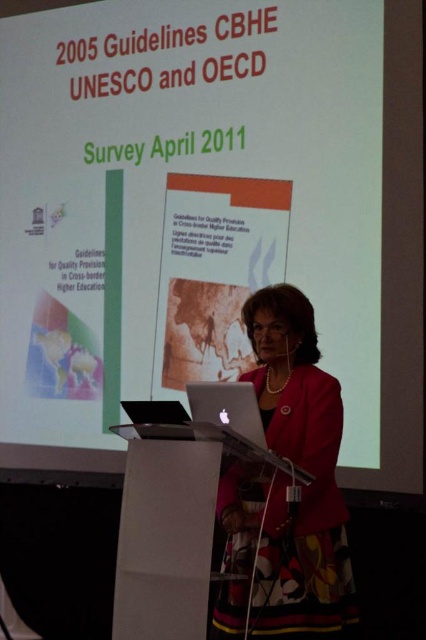
Question: Is matte black blazer at center bigger than silver metallic laptop at center?

Choices:
 (A) yes
 (B) no

Answer: (A)

Question: Among these objects, which one is farthest from the camera?

Choices:
 (A) matte black blazer at center
 (B) silver metallic laptop at center

Answer: (A)

Question: Which point is closer to the camera?

Choices:
 (A) silver metallic laptop at center
 (B) matte black blazer at center

Answer: (A)

Question: Considering the relative positions of matte black blazer at center and silver metallic laptop at center in the image provided, where is matte black blazer at center located with respect to silver metallic laptop at center?

Choices:
 (A) left
 (B) right

Answer: (B)

Question: Is matte black blazer at center to the right of silver metallic laptop at center from the viewer's perspective?

Choices:
 (A) no
 (B) yes

Answer: (B)